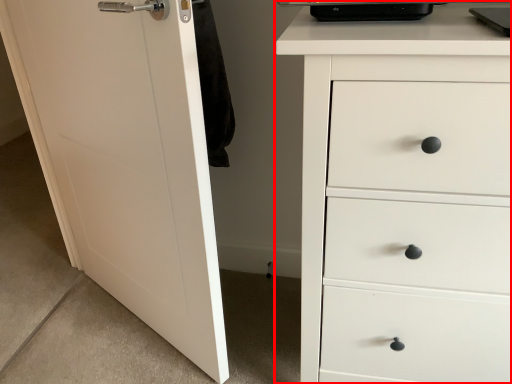
Question: Considering the relative positions of chest of drawers (annotated by the red box) and door in the image provided, where is chest of drawers (annotated by the red box) located with respect to the staircase?

Choices:
 (A) left
 (B) right

Answer: (B)